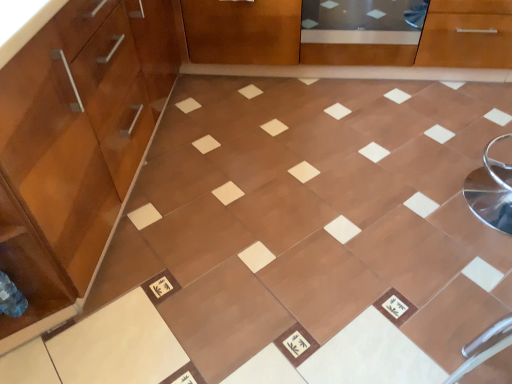
Question: Is transparent glass screen door at upper center positioned behind matte wood cabinetry at left?

Choices:
 (A) no
 (B) yes

Answer: (B)

Question: Is transparent glass screen door at upper center turned away from matte wood cabinetry at left?

Choices:
 (A) yes
 (B) no

Answer: (B)

Question: Does transparent glass screen door at upper center have a lesser height compared to matte wood cabinetry at left?

Choices:
 (A) no
 (B) yes

Answer: (B)

Question: Does transparent glass screen door at upper center contain matte wood cabinetry at left?

Choices:
 (A) no
 (B) yes

Answer: (A)

Question: Is transparent glass screen door at upper center taller than matte wood cabinetry at left?

Choices:
 (A) no
 (B) yes

Answer: (A)

Question: From a real-world perspective, is transparent glass screen door at upper center above or below brown glossy tile at center?

Choices:
 (A) below
 (B) above

Answer: (B)

Question: Considering the positions of transparent glass screen door at upper center and brown glossy tile at center in the image, is transparent glass screen door at upper center taller or shorter than brown glossy tile at center?

Choices:
 (A) tall
 (B) short

Answer: (A)

Question: Is point (338, 29) closer or farther from the camera than point (280, 271)?

Choices:
 (A) closer
 (B) farther

Answer: (B)

Question: From the image's perspective, is transparent glass screen door at upper center above or below brown glossy tile at center?

Choices:
 (A) below
 (B) above

Answer: (B)

Question: In the image, is brown glossy tile at center on the left side or the right side of transparent glass screen door at upper center?

Choices:
 (A) left
 (B) right

Answer: (A)

Question: Choose the correct answer: Is brown glossy tile at center inside transparent glass screen door at upper center or outside it?

Choices:
 (A) outside
 (B) inside

Answer: (A)

Question: Based on their sizes in the image, would you say brown glossy tile at center is bigger or smaller than transparent glass screen door at upper center?

Choices:
 (A) small
 (B) big

Answer: (B)

Question: Looking at their shapes, would you say brown glossy tile at center is wider or thinner than transparent glass screen door at upper center?

Choices:
 (A) thin
 (B) wide

Answer: (B)

Question: Is point (289, 195) closer or farther from the camera than point (31, 61)?

Choices:
 (A) farther
 (B) closer

Answer: (A)

Question: From the image's perspective, is brown glossy tile at center located above or below matte wood cabinetry at left?

Choices:
 (A) above
 (B) below

Answer: (B)